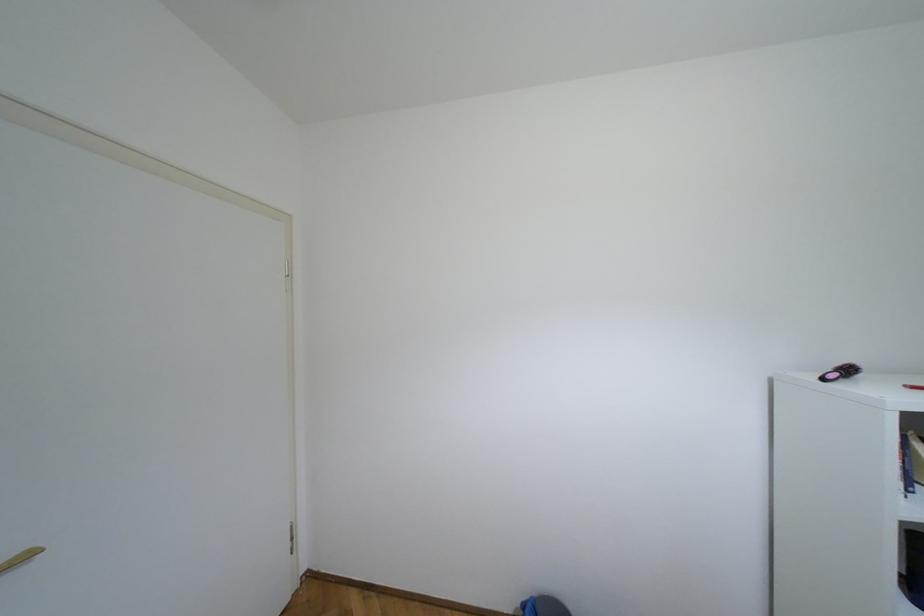
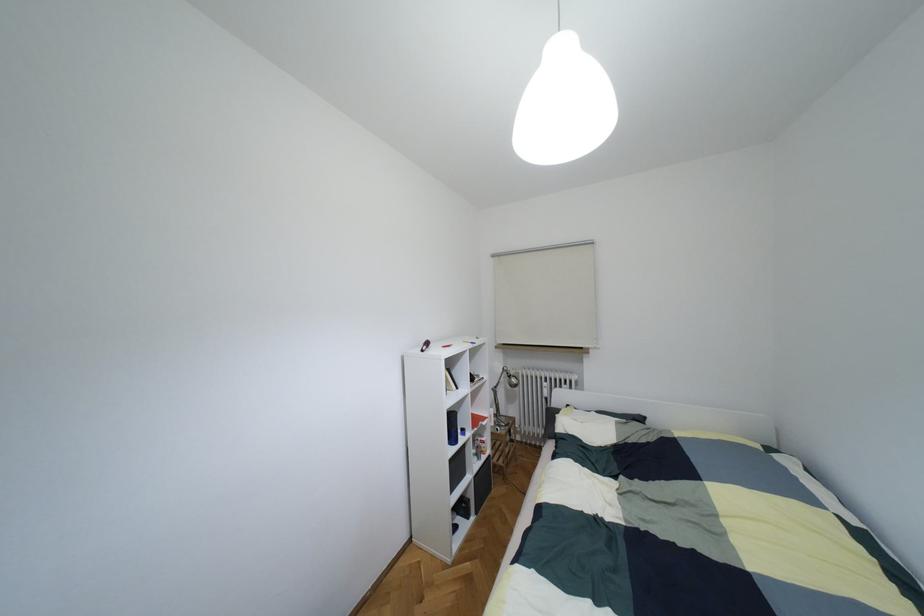
Question: The camera is either moving clockwise (left) or counter-clockwise (right) around the object. The first image is from the beginning of the video and the second image is from the end. Is the camera moving left or right when shooting the video?

Choices:
 (A) Left
 (B) Right

Answer: (A)